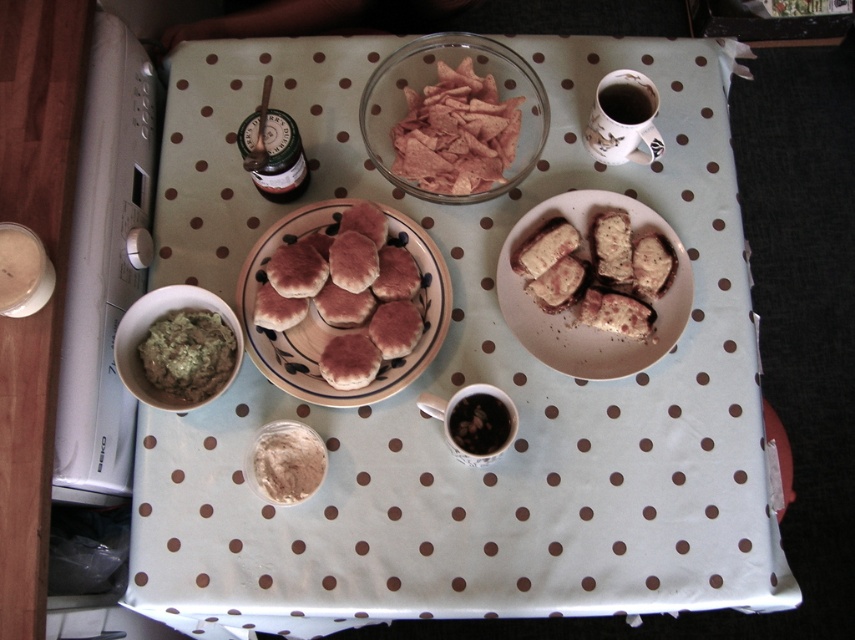
Question: Can you confirm if pink matte pita bread at center is positioned to the right of powdery beige powder at center?

Choices:
 (A) yes
 (B) no

Answer: (A)

Question: Which point is farther to the camera?

Choices:
 (A) (351, 314)
 (B) (622, 563)

Answer: (A)

Question: Does pink matte pita bread at center have a smaller size compared to green creamy guacamole at bottom left?

Choices:
 (A) no
 (B) yes

Answer: (A)

Question: Which point is closer to the camera?

Choices:
 (A) (435, 172)
 (B) (322, 472)
 (C) (401, 362)

Answer: (B)

Question: Can you confirm if pink matte tortilla chips at center is bigger than green creamy guacamole at bottom left?

Choices:
 (A) no
 (B) yes

Answer: (B)

Question: Which object appears closest to the camera in this image?

Choices:
 (A) powdery beige powder at center
 (B) pink matte tortilla chips at center
 (C) green creamy guacamole at bottom left

Answer: (A)